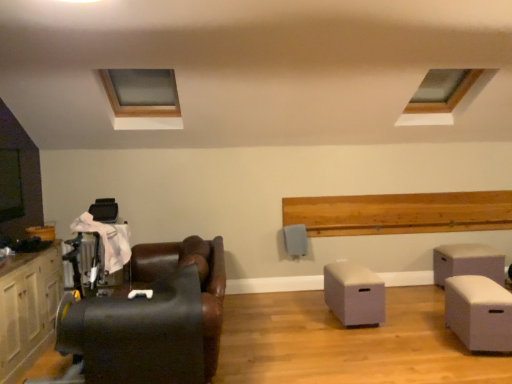
Where is `transparent glass window at upper right`? The image size is (512, 384). transparent glass window at upper right is located at coordinates (442, 90).

This screenshot has height=384, width=512. Describe the element at coordinates (143, 96) in the screenshot. I see `wooden frame at upper left` at that location.

This screenshot has width=512, height=384. I want to click on white matte storage box at center, arranged as the third table when viewed from the right, so click(354, 294).

Measure the distance between point (144, 311) and camera.

They are 8.90 feet apart.

Find the location of `white matte storage box at lower right, which appears as the 2th table when viewed from the right`. white matte storage box at lower right, which appears as the 2th table when viewed from the right is located at coordinates (479, 312).

Locate an element on the screen. This screenshot has width=512, height=384. matte white cabinet at left is located at coordinates (28, 309).

The height and width of the screenshot is (384, 512). I want to click on transparent glass window at upper right, so click(x=442, y=90).

Are white matte storage box at center, marked as the first table in a left-to-right arrangement, and white matte storage box at lower right, which appears as the 2th table when viewed from the right, far apart?

No, white matte storage box at center, marked as the first table in a left-to-right arrangement, is in close proximity to white matte storage box at lower right, which appears as the 2th table when viewed from the right.

Looking at this image, in terms of size, does white matte storage box at center, acting as the second table starting from the front, appear bigger or smaller than white matte storage box at lower right, which appears as the third table when viewed from the back?

Clearly, white matte storage box at center, acting as the second table starting from the front, is smaller in size than white matte storage box at lower right, which appears as the third table when viewed from the back.

From a real-world perspective, is white matte storage box at center, arranged as the third table when viewed from the right, under white matte storage box at lower right, which appears as the 2th table when viewed from the right?

→ Actually, white matte storage box at center, arranged as the third table when viewed from the right, is physically above white matte storage box at lower right, which appears as the 2th table when viewed from the right, in the real world.

At what (x,y) coordinates should I click in order to perform the action: click on the 1st table directly above the white matte storage box at lower right, placed as the 1th table when sorted from front to back (from a real-world perspective). Please return your answer as a coordinate pair (x, y). The image size is (512, 384). Looking at the image, I should click on (354, 294).

Is white matte storage box at center, acting as the 2th table starting from the back, oriented away from transparent glass window at upper right?

white matte storage box at center, acting as the 2th table starting from the back, is not turned away from transparent glass window at upper right.

How many degrees apart are the facing directions of white matte storage box at center, acting as the second table starting from the front, and transparent glass window at upper right?

1.43 degrees.

Is point (362, 285) positioned behind point (424, 94)?

That is False.

Looking at this image, is beige fabric ottoman at right, arranged as the third table when viewed from the front, at the right side of matte white cabinet at left?

Correct, you'll find beige fabric ottoman at right, arranged as the third table when viewed from the front, to the right of matte white cabinet at left.

Is beige fabric ottoman at right, which ranks as the 1th table in back-to-front order, oriented towards matte white cabinet at left?

No, beige fabric ottoman at right, which ranks as the 1th table in back-to-front order, is not oriented towards matte white cabinet at left.

What are the coordinates of `the 1st table located beneath the matte white cabinet at left (from a real-world perspective)` in the screenshot? It's located at (467, 262).

Which object is positioned more to the left, matte white cabinet at left or black leather chair at left?

matte white cabinet at left.

Consider the image. From a real-world perspective, between matte white cabinet at left and black leather chair at left, who is vertically lower?

black leather chair at left.

Does matte white cabinet at left have a smaller size compared to black leather chair at left?

Correct, matte white cabinet at left occupies less space than black leather chair at left.

Is matte white cabinet at left positioned in front of black leather chair at left?

No, it is behind black leather chair at left.

Between black leather chair at left and white matte storage box at lower right, the 2th table from the left, which one is positioned behind?

white matte storage box at lower right, the 2th table from the left.

This screenshot has width=512, height=384. Find the location of `table that is the 1st one when counting backward from the black leather chair at left`. table that is the 1st one when counting backward from the black leather chair at left is located at coordinates (479, 312).

Does black leather chair at left contain white matte storage box at lower right, which appears as the 2th table when viewed from the right?

That's incorrect, white matte storage box at lower right, which appears as the 2th table when viewed from the right, is not inside black leather chair at left.

Are black leather chair at left and white matte storage box at lower right, which appears as the 2th table when viewed from the right, beside each other?

No, black leather chair at left is not making contact with white matte storage box at lower right, which appears as the 2th table when viewed from the right.

Considering the relative sizes of white matte storage box at lower right, the 2th table from the left, and beige fabric ottoman at right, which is counted as the third table, starting from the left, in the image provided, is white matte storage box at lower right, the 2th table from the left, smaller than beige fabric ottoman at right, which is counted as the third table, starting from the left,?

Yes, white matte storage box at lower right, the 2th table from the left, is smaller than beige fabric ottoman at right, which is counted as the third table, starting from the left.

Is there a large distance between white matte storage box at lower right, which appears as the third table when viewed from the back, and beige fabric ottoman at right, which is the 1th table from right to left?

That's not correct — white matte storage box at lower right, which appears as the third table when viewed from the back, is a little close to beige fabric ottoman at right, which is the 1th table from right to left.

From the beige fabric ottoman at right, arranged as the third table when viewed from the front, count the 1st table to the left and point to it. Please provide its 2D coordinates.

[(479, 312)]

Which is in front, point (480, 304) or point (497, 255)?

Point (480, 304)

Which of these two, black leather chair at left or matte white cabinet at left, is bigger?

With larger size is black leather chair at left.

How many degrees apart are the facing directions of black leather chair at left and matte white cabinet at left?

179 degrees separate the facing orientations of black leather chair at left and matte white cabinet at left.

From a real-world perspective, which object stands above the other?

In real-world perspective, matte white cabinet at left is above.

From the image's perspective, starting from the white matte storage box at lower right, the 2th table from the left, which table is the 1st one above? Please provide its 2D coordinates.

[(354, 294)]

The image size is (512, 384). In order to click on window positioned vertically above the white matte storage box at center, marked as the first table in a left-to-right arrangement (from a real-world perspective) in this screenshot , I will do `click(442, 90)`.

Looking at the image, which one is located further to white matte storage box at center, acting as the 2th table starting from the back, black leather chair at left or wooden frame at upper left?

wooden frame at upper left.

Based on their spatial positions, is beige fabric ottoman at right, which ranks as the 1th table in back-to-front order, or black leather chair at left further from matte white cabinet at left?

Based on the image, beige fabric ottoman at right, which ranks as the 1th table in back-to-front order, appears to be further to matte white cabinet at left.

Looking at the image, which one is located further to beige fabric ottoman at right, which is counted as the third table, starting from the left, transparent glass window at upper right or white matte storage box at lower right, placed as the 1th table when sorted from front to back?

transparent glass window at upper right is further to beige fabric ottoman at right, which is counted as the third table, starting from the left.

When comparing their distances from matte white cabinet at left, does black leather chair at left or transparent glass window at upper right seem closer?

The object closer to matte white cabinet at left is black leather chair at left.

Considering their positions, is matte white cabinet at left positioned further to black leather chair at left than beige fabric ottoman at right, arranged as the third table when viewed from the front?

beige fabric ottoman at right, arranged as the third table when viewed from the front, is positioned further to the anchor black leather chair at left.

When comparing their distances from wooden frame at upper left, does beige fabric ottoman at right, which ranks as the 1th table in back-to-front order, or black leather chair at left seem further?

beige fabric ottoman at right, which ranks as the 1th table in back-to-front order, is positioned further to the anchor wooden frame at upper left.

Looking at the image, which one is located closer to black leather chair at left, wooden frame at upper left or transparent glass window at upper right?

wooden frame at upper left lies closer to black leather chair at left than the other object.

Based on their spatial positions, is transparent glass window at upper right or white matte storage box at center, arranged as the third table when viewed from the right, closer to beige fabric ottoman at right, which is the 1th table from right to left?

The object closer to beige fabric ottoman at right, which is the 1th table from right to left, is white matte storage box at center, arranged as the third table when viewed from the right.

I want to click on window between wooden frame at upper left and beige fabric ottoman at right, which ranks as the 1th table in back-to-front order, in the horizontal direction, so click(442, 90).

At what (x,y) coordinates should I click in order to perform the action: click on window between black leather chair at left and white matte storage box at lower right, the 2th table from the left, in the horizontal direction. Please return your answer as a coordinate pair (x, y). The image size is (512, 384). Looking at the image, I should click on (x=442, y=90).

Where is `window located between matte white cabinet at left and white matte storage box at lower right, which appears as the 2th table when viewed from the right, in the left-right direction`? window located between matte white cabinet at left and white matte storage box at lower right, which appears as the 2th table when viewed from the right, in the left-right direction is located at coordinates (442, 90).

Identify the location of window located between wooden frame at upper left and white matte storage box at lower right, which appears as the 2th table when viewed from the right, in the left-right direction. (442, 90).